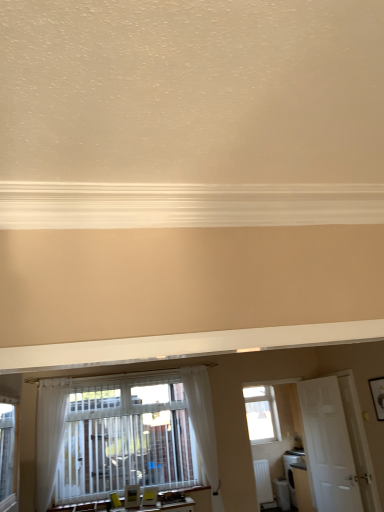
Image resolution: width=384 pixels, height=512 pixels. What do you see at coordinates (282, 493) in the screenshot?
I see `white plastic radiator at lower right` at bounding box center [282, 493].

The width and height of the screenshot is (384, 512). Describe the element at coordinates (328, 447) in the screenshot. I see `white wooden door at right` at that location.

I want to click on white matte radiator at lower right, so click(x=263, y=484).

Where is `clear glass window at center`? The height and width of the screenshot is (512, 384). clear glass window at center is located at coordinates (261, 414).

Measure the distance between white sheer curtain at center, the second curtain in the left-to-right sequence, and camera.

They are 3.86 meters apart.

At what (x,y) coordinates should I click in order to perform the action: click on white plastic radiator at lower right. Please return your answer as a coordinate pair (x, y). The width and height of the screenshot is (384, 512). Looking at the image, I should click on (282, 493).

Is white sheer curtain at center, the second curtain in the left-to-right sequence, far from clear glass window at center?

No, white sheer curtain at center, the second curtain in the left-to-right sequence, is not far from clear glass window at center.

From the image's perspective, which one is positioned lower, white sheer curtain at center, marked as the first curtain in a right-to-left arrangement, or clear glass window at center?

clear glass window at center appears lower in the image.

Does white sheer curtain at center, marked as the first curtain in a right-to-left arrangement, come in front of clear glass window at center?

That is True.

Can you confirm if white sheer curtain at center, marked as the first curtain in a right-to-left arrangement, is positioned to the left of clear glass window at center?

Yes, white sheer curtain at center, marked as the first curtain in a right-to-left arrangement, is to the left of clear glass window at center.

Is the depth of white plastic radiator at lower right less than that of white wooden door at right?

No, the depth of white plastic radiator at lower right is greater than that of white wooden door at right.

Is white plastic radiator at lower right positioned beyond the bounds of white wooden door at right?

Yes, white plastic radiator at lower right is located beyond the bounds of white wooden door at right.

From the image's perspective, is white plastic radiator at lower right located above white wooden door at right?

Incorrect, from the image's perspective, white plastic radiator at lower right is lower than white wooden door at right.

Is white plastic radiator at lower right facing away from white wooden door at right?

No, white plastic radiator at lower right is not facing away from white wooden door at right.

From the image's perspective, would you say white plastic radiator at lower right is positioned over white matte radiator at lower right?

Incorrect, from the image's perspective, white plastic radiator at lower right is lower than white matte radiator at lower right.

Consider the image. Which of these two, white plastic radiator at lower right or white matte radiator at lower right, stands taller?

white matte radiator at lower right is taller.

Considering the sizes of white plastic radiator at lower right and white matte radiator at lower right in the image, is white plastic radiator at lower right bigger or smaller than white matte radiator at lower right?

In the image, white plastic radiator at lower right appears to be larger than white matte radiator at lower right.

Where is `appliance lying below the white matte radiator at lower right (from the image's perspective)`? This screenshot has width=384, height=512. appliance lying below the white matte radiator at lower right (from the image's perspective) is located at coordinates (282, 493).

Considering the relative sizes of white sheer curtain at lower left, which is counted as the 2th curtain, starting from the right, and clear glass window at center in the image provided, is white sheer curtain at lower left, which is counted as the 2th curtain, starting from the right, bigger than clear glass window at center?

Correct, white sheer curtain at lower left, which is counted as the 2th curtain, starting from the right, is larger in size than clear glass window at center.

From a real-world perspective, is white sheer curtain at lower left, which is counted as the 2th curtain, starting from the right, beneath clear glass window at center?

Indeed, from a real-world perspective, white sheer curtain at lower left, which is counted as the 2th curtain, starting from the right, is positioned beneath clear glass window at center.

Is clear glass window at center surrounded by white sheer curtain at lower left, which is counted as the 2th curtain, starting from the right?

That's incorrect, clear glass window at center is not inside white sheer curtain at lower left, which is counted as the 2th curtain, starting from the right.

Does white sheer curtain at lower left, arranged as the 1th curtain when viewed from the left, have a greater height compared to clear glass window at center?

Correct, white sheer curtain at lower left, arranged as the 1th curtain when viewed from the left, is much taller as clear glass window at center.

From the picture: Is white sheer curtain at center, the second curtain in the left-to-right sequence, aimed at white plastic radiator at lower right?

No, white sheer curtain at center, the second curtain in the left-to-right sequence, is not oriented towards white plastic radiator at lower right.

Is white sheer curtain at center, marked as the first curtain in a right-to-left arrangement, positioned far away from white plastic radiator at lower right?

Actually, white sheer curtain at center, marked as the first curtain in a right-to-left arrangement, and white plastic radiator at lower right are a little close together.

Is white sheer curtain at center, the second curtain in the left-to-right sequence, shorter than white plastic radiator at lower right?

In fact, white sheer curtain at center, the second curtain in the left-to-right sequence, may be taller than white plastic radiator at lower right.

Is white sheer curtain at center, the second curtain in the left-to-right sequence, at the right side of white plastic radiator at lower right?

Incorrect, white sheer curtain at center, the second curtain in the left-to-right sequence, is not on the right side of white plastic radiator at lower right.

Can you confirm if white sheer curtain at lower left, arranged as the 1th curtain when viewed from the left, is shorter than white plastic radiator at lower right?

No, white sheer curtain at lower left, arranged as the 1th curtain when viewed from the left, is not shorter than white plastic radiator at lower right.

Looking at this image, does white sheer curtain at lower left, which is counted as the 2th curtain, starting from the right, have a smaller size compared to white plastic radiator at lower right?

Actually, white sheer curtain at lower left, which is counted as the 2th curtain, starting from the right, might be larger than white plastic radiator at lower right.

Is white sheer curtain at lower left, which is counted as the 2th curtain, starting from the right, facing towards white plastic radiator at lower right?

No, white sheer curtain at lower left, which is counted as the 2th curtain, starting from the right, does not turn towards white plastic radiator at lower right.

Are white sheer curtain at lower left, arranged as the 1th curtain when viewed from the left, and white plastic radiator at lower right making contact?

They are not placed beside each other.

Is clear glass window at center shorter than white plastic radiator at lower right?

In fact, clear glass window at center may be taller than white plastic radiator at lower right.

Locate an element on the screen. This screenshot has height=512, width=384. window that is above the white plastic radiator at lower right (from the image's perspective) is located at coordinates (261, 414).

Is clear glass window at center looking in the opposite direction of white plastic radiator at lower right?

No, clear glass window at center's orientation is not away from white plastic radiator at lower right.

In the image, is clear glass window at center on the left side or the right side of white plastic radiator at lower right?

clear glass window at center is to the left of white plastic radiator at lower right.

From the image's perspective, which curtain is the 1st one above the clear glass window at center? Please provide its 2D coordinates.

[(203, 426)]

Where is `appliance below the white wooden door at right (from the image's perspective)`? Image resolution: width=384 pixels, height=512 pixels. appliance below the white wooden door at right (from the image's perspective) is located at coordinates (282, 493).

Looking at the image, which one is located further to white sheer curtain at lower left, which is counted as the 2th curtain, starting from the right, clear glass window at center or white sheer curtain at center, marked as the first curtain in a right-to-left arrangement?

Among the two, clear glass window at center is located further to white sheer curtain at lower left, which is counted as the 2th curtain, starting from the right.

Looking at the image, which one is located closer to white wooden door at right, white sheer curtain at center, marked as the first curtain in a right-to-left arrangement, or white sheer curtain at lower left, arranged as the 1th curtain when viewed from the left?

white sheer curtain at center, marked as the first curtain in a right-to-left arrangement, is positioned closer to the anchor white wooden door at right.

Based on their spatial positions, is white sheer curtain at lower left, arranged as the 1th curtain when viewed from the left, or white plastic radiator at lower right further from white wooden door at right?

white sheer curtain at lower left, arranged as the 1th curtain when viewed from the left, is positioned further to the anchor white wooden door at right.

From the image, which object appears to be nearer to white wooden door at right, white plastic radiator at lower right or clear glass window at center?

clear glass window at center is positioned closer to the anchor white wooden door at right.

Estimate the real-world distances between objects in this image. Which object is closer to white wooden door at right, white sheer curtain at center, marked as the first curtain in a right-to-left arrangement, or clear glass window at center?

The object closer to white wooden door at right is clear glass window at center.

Estimate the real-world distances between objects in this image. Which object is closer to white sheer curtain at lower left, arranged as the 1th curtain when viewed from the left, white wooden door at right or white plastic radiator at lower right?

white plastic radiator at lower right is closer to white sheer curtain at lower left, arranged as the 1th curtain when viewed from the left.

When comparing their distances from white sheer curtain at lower left, which is counted as the 2th curtain, starting from the right, does clear glass window at center or white matte radiator at lower right seem closer?

Among the two, clear glass window at center is located nearer to white sheer curtain at lower left, which is counted as the 2th curtain, starting from the right.

Based on their spatial positions, is white sheer curtain at center, the second curtain in the left-to-right sequence, or white matte radiator at lower right closer to clear glass window at center?

white matte radiator at lower right.

This screenshot has height=512, width=384. What are the coordinates of `appliance between white sheer curtain at lower left, which is counted as the 2th curtain, starting from the right, and clear glass window at center, along the z-axis` in the screenshot? It's located at (282, 493).

Locate an element on the screen. Image resolution: width=384 pixels, height=512 pixels. radiator positioned between white sheer curtain at center, the second curtain in the left-to-right sequence, and clear glass window at center from near to far is located at coordinates (263, 484).

Locate an element on the screen. curtain between white wooden door at right and clear glass window at center from front to back is located at coordinates click(x=203, y=426).

Find the location of a particular element. The height and width of the screenshot is (512, 384). radiator between white sheer curtain at lower left, arranged as the 1th curtain when viewed from the left, and white plastic radiator at lower right is located at coordinates (263, 484).